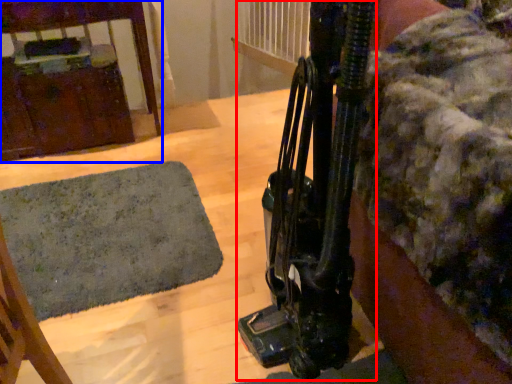
Question: Which object appears closest to the camera in this image, equipment (highlighted by a red box) or furniture (highlighted by a blue box)?

Choices:
 (A) equipment
 (B) furniture

Answer: (A)